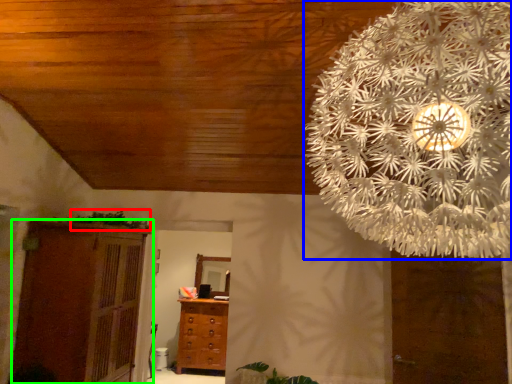
Question: Considering the real-world distances, which object is farthest from plant (highlighted by a red box)? flower (highlighted by a blue box) or cupboard (highlighted by a green box)?

Choices:
 (A) flower
 (B) cupboard

Answer: (A)